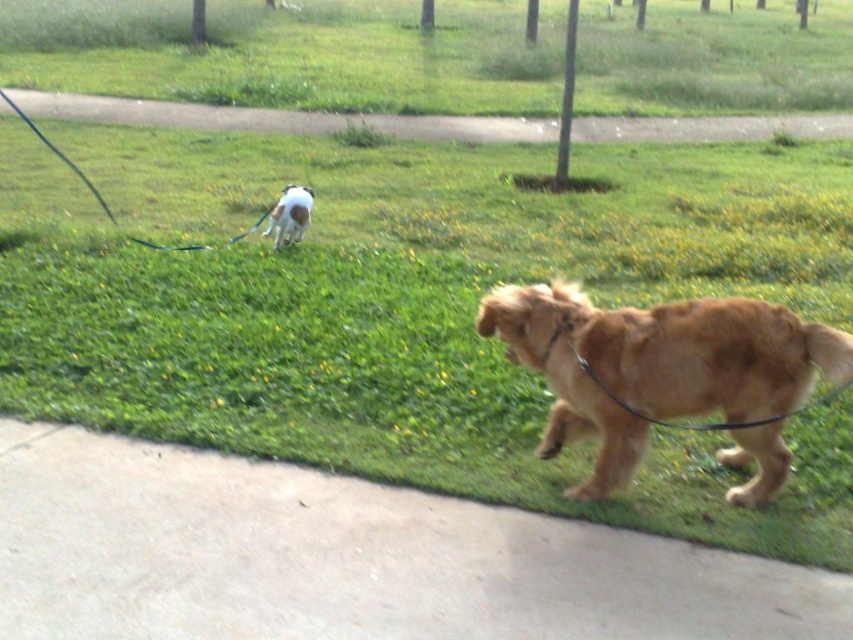
You are a dog owner who wants to ensure your golden fur dog at center is visible to others while walking. Since the black rubber leash at upper left is attached to it, does the leash length allow others to easily see the dog?

The golden fur dog at center has a lesser height compared to black rubber leash at upper left, meaning the leash is taller than the dog. This could make the dog harder to see if the leash blocks the view, so adjust the leash length for better visibility.

You are a dog owner who wants to ensure your golden fur dog at center stays within a 5 meter safety zone while walking. The black rubber leash at upper left is currently attached to the dog. Can you confirm if the dog is within the safety zone based on their current positions?

The golden fur dog at center and the black rubber leash at upper left are 4.49 meters apart. Since the leash length is 4.49 meters and the safety zone is 5 meters, the dog is within the safety zone as 4.49 meters is less than 5 meters.